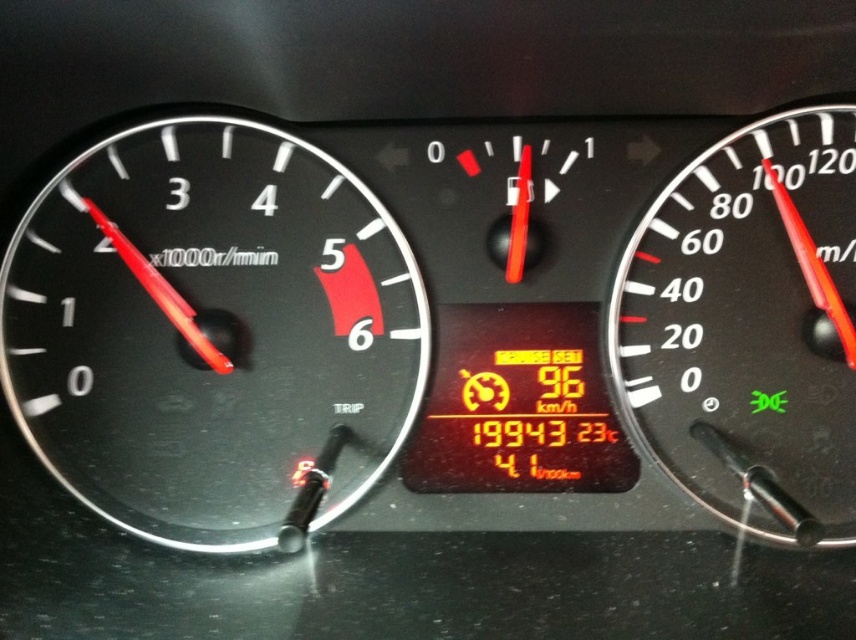
Based on the photo, you are driving a car and want to check both the black matte speedometer at left and the black plastic speedometer at right. Which one should you look at first if you want to monitor your current speed?

The black matte speedometer at left is to the left of the black plastic speedometer at right, so you should look at the black matte speedometer at left first if you want to monitor your current speed.

You are sitting in the driver seat and want to check both the black matte speedometer at left and the black plastic speedometer at right. Which one will you look at first if you want to check the one closer to you?

The black matte speedometer at left is closer to you, so you will look at the black matte speedometer at left first.